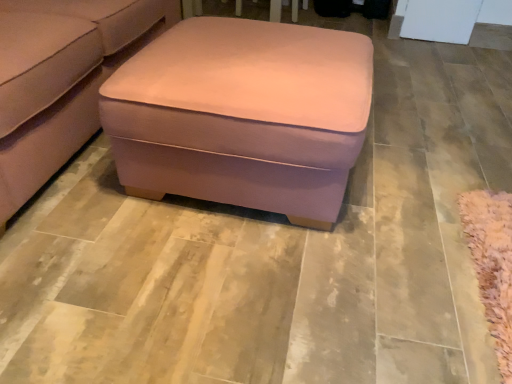
You are a GUI agent. You are given a task and a screenshot of the screen. Output one action in this format:
    pyautogui.click(x=<x>, y=<y>)
    Task: Click on the pink fabric ottoman at center
    The image size is (512, 384).
    Given the screenshot: What is the action you would take?
    pyautogui.click(x=243, y=114)

What do you see at coordinates (243, 114) in the screenshot?
I see `pink fabric ottoman at center` at bounding box center [243, 114].

The image size is (512, 384). What do you see at coordinates (66, 87) in the screenshot? I see `suede-like pink ottoman at center` at bounding box center [66, 87].

At what (x,y) coordinates should I click in order to perform the action: click on suede-like pink ottoman at center. Please return your answer as a coordinate pair (x, y). Image resolution: width=512 pixels, height=384 pixels. Looking at the image, I should click on (66, 87).

At what (x,y) coordinates should I click in order to perform the action: click on pink fabric ottoman at center. Please return your answer as a coordinate pair (x, y). Looking at the image, I should click on (243, 114).

Which object is positioned more to the left, suede-like pink ottoman at center or pink fabric ottoman at center?

suede-like pink ottoman at center.

Is suede-like pink ottoman at center closer to the viewer compared to pink fabric ottoman at center?

Yes, it is.

Does point (144, 35) come in front of point (178, 48)?

No, (144, 35) is behind (178, 48).

From the image's perspective, is suede-like pink ottoman at center above or below pink fabric ottoman at center?

suede-like pink ottoman at center is situated higher than pink fabric ottoman at center in the image.

From a real-world perspective, who is located lower, suede-like pink ottoman at center or pink fabric ottoman at center?

pink fabric ottoman at center is physically lower.

From the picture: Is suede-like pink ottoman at center wider than pink fabric ottoman at center?

Yes, suede-like pink ottoman at center is wider than pink fabric ottoman at center.

Considering the relative sizes of suede-like pink ottoman at center and pink fabric ottoman at center in the image provided, is suede-like pink ottoman at center taller than pink fabric ottoman at center?

Yes, suede-like pink ottoman at center is taller than pink fabric ottoman at center.

Is suede-like pink ottoman at center smaller than pink fabric ottoman at center?

Incorrect, suede-like pink ottoman at center is not smaller in size than pink fabric ottoman at center.

Is pink fabric ottoman at center a part of suede-like pink ottoman at center?

No.

Is suede-like pink ottoman at center positioned far away from pink fabric ottoman at center?

No, suede-like pink ottoman at center is not far from pink fabric ottoman at center.

Is suede-like pink ottoman at center facing towards pink fabric ottoman at center?

Yes, suede-like pink ottoman at center is aimed at pink fabric ottoman at center.

Image resolution: width=512 pixels, height=384 pixels. In the image, there is a suede-like pink ottoman at center. Find the location of `table below it (from a real-world perspective)`. table below it (from a real-world perspective) is located at coordinates (243, 114).

Considering the positions of objects pink fabric ottoman at center and suede-like pink ottoman at center in the image provided, who is more to the left, pink fabric ottoman at center or suede-like pink ottoman at center?

Positioned to the left is suede-like pink ottoman at center.

Considering the positions of objects pink fabric ottoman at center and suede-like pink ottoman at center in the image provided, who is in front, pink fabric ottoman at center or suede-like pink ottoman at center?

Positioned in front is suede-like pink ottoman at center.

Which point is more distant from viewer, (324, 31) or (96, 130)?

The point (96, 130) is behind.

From the image's perspective, relative to suede-like pink ottoman at center, is pink fabric ottoman at center above or below?

pink fabric ottoman at center is situated lower than suede-like pink ottoman at center in the image.

From the picture: From a real-world perspective, is pink fabric ottoman at center beneath suede-like pink ottoman at center?

Yes, from a real-world perspective, pink fabric ottoman at center is under suede-like pink ottoman at center.

Between pink fabric ottoman at center and suede-like pink ottoman at center, which one has smaller width?

Thinner between the two is pink fabric ottoman at center.

Which of these two, pink fabric ottoman at center or suede-like pink ottoman at center, stands shorter?

With less height is pink fabric ottoman at center.

Who is bigger, pink fabric ottoman at center or suede-like pink ottoman at center?

Bigger between the two is suede-like pink ottoman at center.

Is pink fabric ottoman at center surrounding suede-like pink ottoman at center?

No, pink fabric ottoman at center does not contain suede-like pink ottoman at center.

Can you see pink fabric ottoman at center touching suede-like pink ottoman at center?

No, pink fabric ottoman at center is not in contact with suede-like pink ottoman at center.

Is pink fabric ottoman at center positioned with its back to suede-like pink ottoman at center?

Absolutely, pink fabric ottoman at center is directed away from suede-like pink ottoman at center.

What's the angular difference between pink fabric ottoman at center and suede-like pink ottoman at center's facing directions?

0.00126 degrees separate the facing orientations of pink fabric ottoman at center and suede-like pink ottoman at center.

The image size is (512, 384). In order to click on table on the right of the suede-like pink ottoman at center in this screenshot , I will do `click(243, 114)`.

In the image, there is a pink fabric ottoman at center. Where is `studio couch above it (from the image's perspective)`? The height and width of the screenshot is (384, 512). studio couch above it (from the image's perspective) is located at coordinates (66, 87).

You are a GUI agent. You are given a task and a screenshot of the screen. Output one action in this format:
    pyautogui.click(x=<x>, y=<y>)
    Task: Click on the studio couch on the left of the pink fabric ottoman at center
    
    Given the screenshot: What is the action you would take?
    point(66,87)